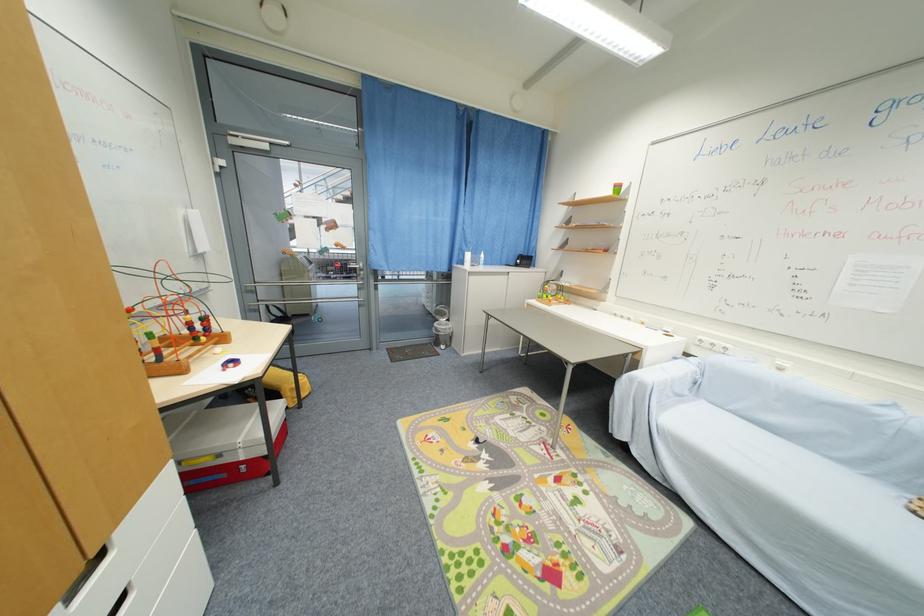
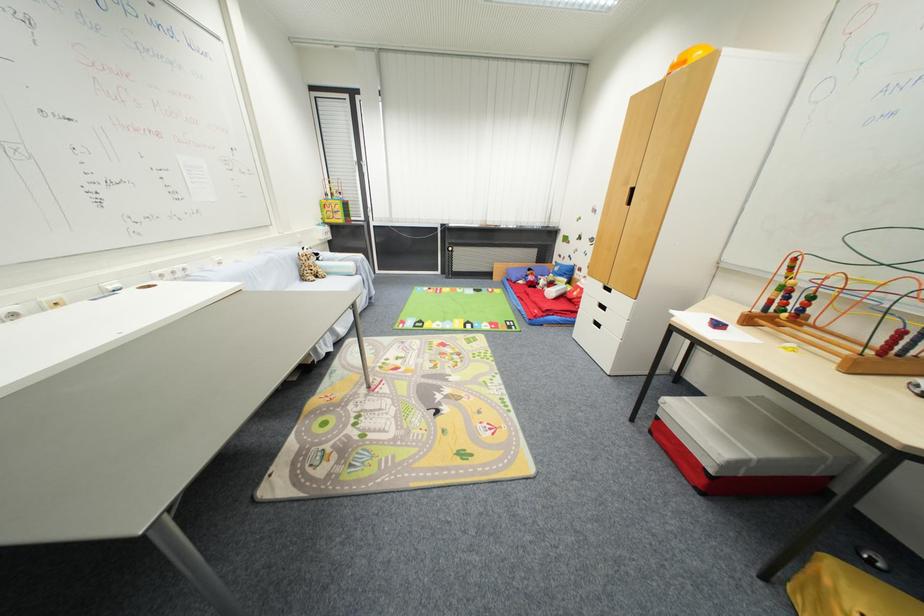
Find the pixel in the second image that matches (x=201, y=341) in the first image.

(789, 313)